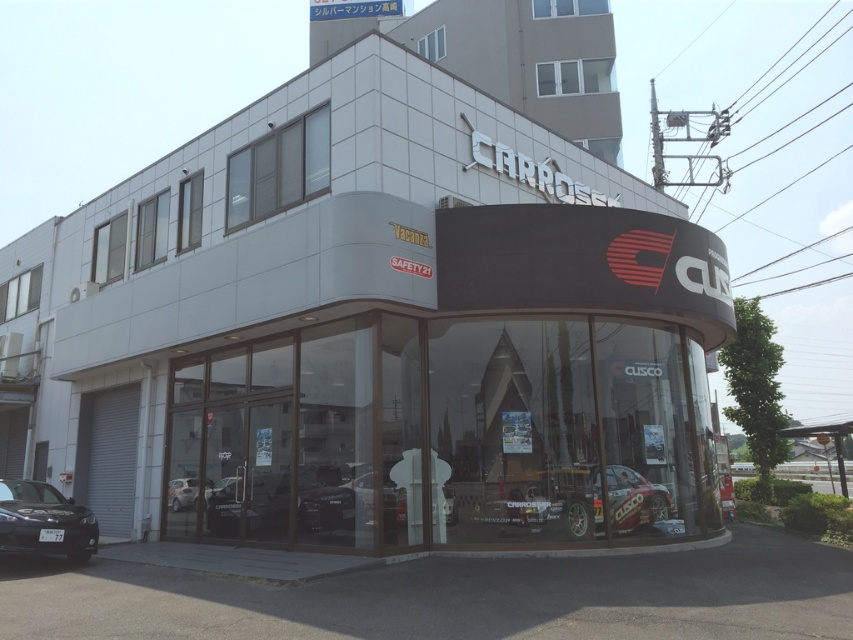
Is point (312, 349) in front of point (585, 524)?

That is False.

Does white matte building at center have a smaller size compared to matte black car at center?

Actually, white matte building at center might be larger than matte black car at center.

Which is in front, point (277, 419) or point (665, 502)?

Positioned in front is point (665, 502).

Locate an element on the screen. white matte building at center is located at coordinates (364, 323).

Can you confirm if satin black car at center is positioned to the right of shiny silver car at center?

Yes, satin black car at center is to the right of shiny silver car at center.

Does satin black car at center appear on the left side of shiny silver car at center?

In fact, satin black car at center is to the right of shiny silver car at center.

Is point (339, 483) farther from camera compared to point (198, 484)?

No.

Find the location of a particular element. The height and width of the screenshot is (640, 853). satin black car at center is located at coordinates (334, 499).

Who is shorter, shiny black car at lower left or satin black car at center?

satin black car at center is shorter.

What do you see at coordinates (44, 522) in the screenshot? This screenshot has width=853, height=640. I see `shiny black car at lower left` at bounding box center [44, 522].

Between point (26, 500) and point (325, 467), which one is positioned behind?

The point (26, 500) is behind.

Find the location of `shiny black car at lower left`. shiny black car at lower left is located at coordinates (44, 522).